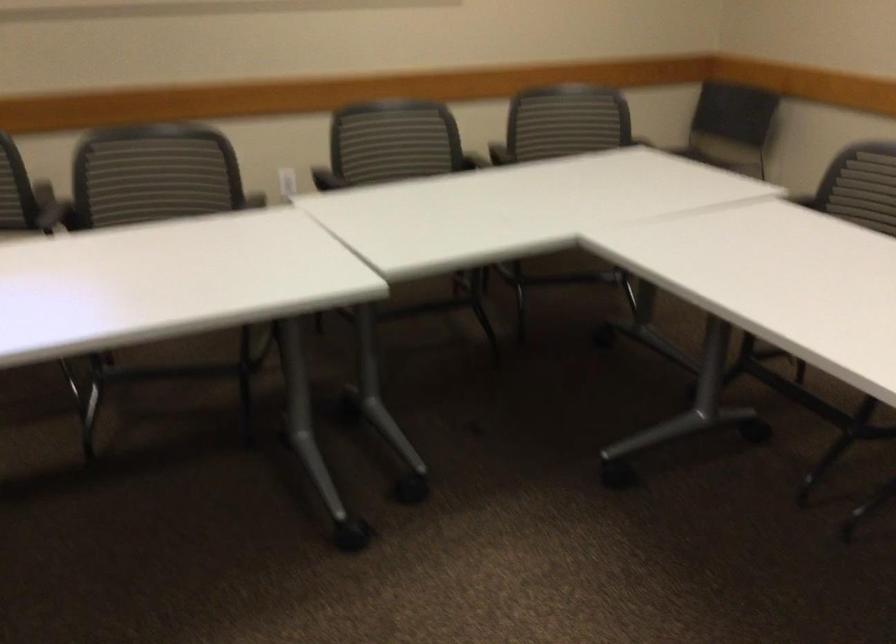
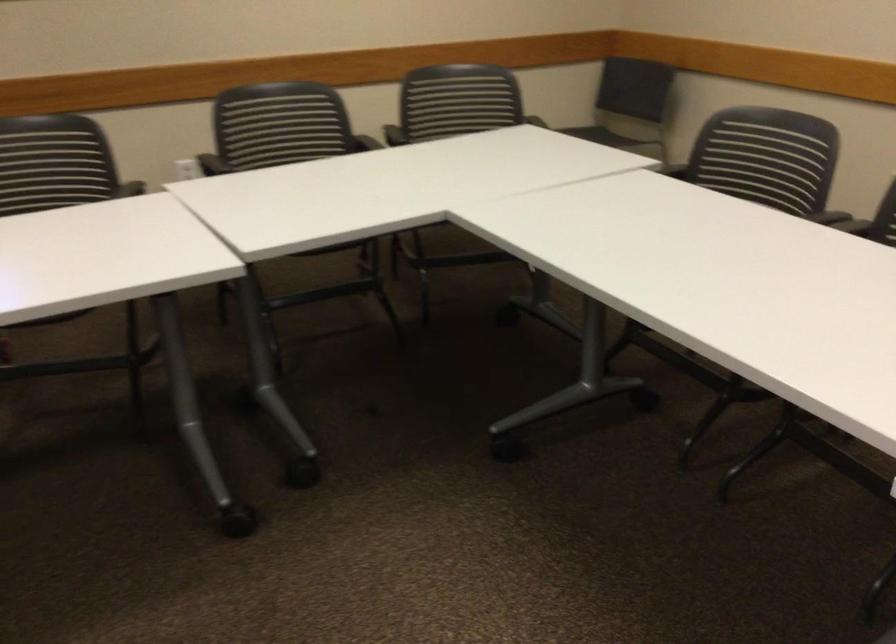
Question: Based on the continuous images, in which direction is the camera rotating? Reply with the corresponding letter.

Choices:
 (A) Left
 (B) Right
 (C) Up
 (D) Down

Answer: (B)